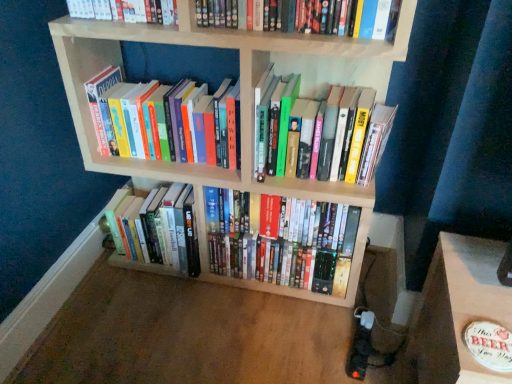
Question: From the image's perspective, is hardcover books at left, acting as the 4th book starting from the bottom, above shiny plastic dvds at center, the 1th book positioned from the bottom?

Choices:
 (A) yes
 (B) no

Answer: (A)

Question: From a real-world perspective, is hardcover books at left, acting as the 4th book starting from the bottom, positioned under shiny plastic dvds at center, placed as the 5th book when sorted from top to bottom, based on gravity?

Choices:
 (A) yes
 (B) no

Answer: (B)

Question: Is hardcover books at left, the 2th book when ordered from top to bottom, positioned behind shiny plastic dvds at center, placed as the 5th book when sorted from top to bottom?

Choices:
 (A) no
 (B) yes

Answer: (A)

Question: Could you tell me if hardcover books at left, acting as the 4th book starting from the bottom, is facing shiny plastic dvds at center, placed as the 5th book when sorted from top to bottom?

Choices:
 (A) yes
 (B) no

Answer: (B)

Question: Is hardcover books at left, the 2th book when ordered from top to bottom, oriented away from shiny plastic dvds at center, placed as the 5th book when sorted from top to bottom?

Choices:
 (A) no
 (B) yes

Answer: (A)

Question: Is point (136, 223) positioned closer to the camera than point (168, 147)?

Choices:
 (A) farther
 (B) closer

Answer: (A)

Question: Considering the relative positions of hardcover books at center, which is counted as the 4th book, starting from the top, and hardcover books at left, acting as the 4th book starting from the bottom, in the image provided, is hardcover books at center, which is counted as the 4th book, starting from the top, to the left or to the right of hardcover books at left, acting as the 4th book starting from the bottom,?

Choices:
 (A) right
 (B) left

Answer: (B)

Question: Is hardcover books at center, the 2th book ordered from the bottom, in front of or behind hardcover books at left, acting as the 4th book starting from the bottom, in the image?

Choices:
 (A) front
 (B) behind

Answer: (B)

Question: Considering the positions of hardcover books at center, which is counted as the 4th book, starting from the top, and hardcover books at left, the 2th book when ordered from top to bottom, in the image, is hardcover books at center, which is counted as the 4th book, starting from the top, bigger or smaller than hardcover books at left, the 2th book when ordered from top to bottom,?

Choices:
 (A) big
 (B) small

Answer: (A)

Question: Looking at their shapes, would you say hardcover books at center, the 2th book ordered from the bottom, is wider or thinner than hardcover book at upper center, placed as the 5th book when sorted from bottom to top?

Choices:
 (A) thin
 (B) wide

Answer: (B)

Question: Relative to hardcover book at upper center, placed as the 5th book when sorted from bottom to top, is hardcover books at center, which is counted as the 4th book, starting from the top, in front or behind?

Choices:
 (A) behind
 (B) front

Answer: (A)

Question: Is hardcover books at center, which is counted as the 4th book, starting from the top, inside or outside of hardcover book at upper center, the first book when ordered from top to bottom?

Choices:
 (A) inside
 (B) outside

Answer: (B)

Question: Based on their sizes in the image, would you say hardcover books at center, which is counted as the 4th book, starting from the top, is bigger or smaller than hardcover book at upper center, the first book when ordered from top to bottom?

Choices:
 (A) big
 (B) small

Answer: (A)

Question: Looking at their shapes, would you say hardcover books at left, the 2th book when ordered from top to bottom, is wider or thinner than hardcover book at upper center, placed as the 5th book when sorted from bottom to top?

Choices:
 (A) thin
 (B) wide

Answer: (B)

Question: From the image's perspective, relative to hardcover book at upper center, the first book when ordered from top to bottom, is hardcover books at left, acting as the 4th book starting from the bottom, above or below?

Choices:
 (A) above
 (B) below

Answer: (B)